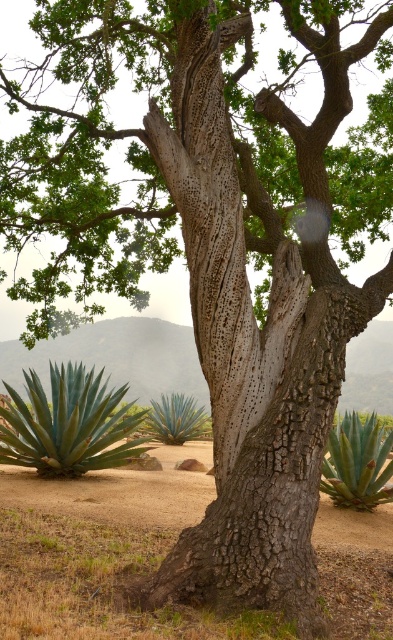
Question: Which point appears closest to the camera in this image?

Choices:
 (A) (165, 429)
 (B) (365, 433)
 (C) (64, 618)
 (D) (95, 458)

Answer: (C)

Question: Does brown dirt field at center appear on the left side of green succulent at center?

Choices:
 (A) no
 (B) yes

Answer: (B)

Question: Does green succulent at lower right appear on the left side of green succulent at center?

Choices:
 (A) yes
 (B) no

Answer: (B)

Question: Which of these objects is positioned farthest from the green succulent at lower left?

Choices:
 (A) green succulent at center
 (B) brown dirt field at center
 (C) green succulent at lower right

Answer: (A)

Question: Does green succulent at lower left lie in front of green succulent at lower right?

Choices:
 (A) yes
 (B) no

Answer: (B)

Question: Which point is farther from the camera taking this photo?

Choices:
 (A) (69, 380)
 (B) (376, 486)
 (C) (194, 422)

Answer: (C)